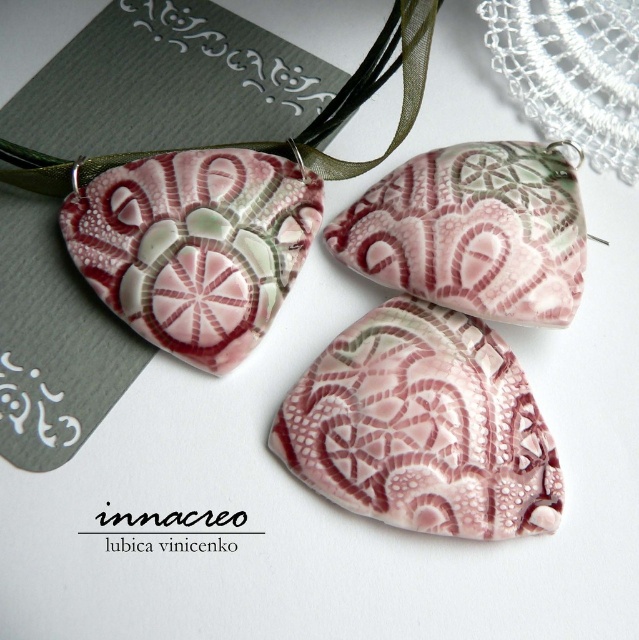
Is pink glossy pendant at center further to the viewer compared to white lace doily at upper right?

No, it is not.

Which is behind, point (502, 156) or point (557, 3)?

Positioned behind is point (502, 156).

The image size is (639, 640). I want to click on pink glossy pendant at center, so click(473, 230).

Find the location of `matte black card at upper center`. matte black card at upper center is located at coordinates (235, 52).

Is matte black card at upper center to the right of pink lace at upper left from the viewer's perspective?

Yes, matte black card at upper center is to the right of pink lace at upper left.

Is point (295, 60) closer to viewer compared to point (12, 426)?

No, (295, 60) is further to viewer.

Where is `matte black card at upper center`? matte black card at upper center is located at coordinates (235, 52).

Is pink porcelain pendant at center bigger than white lace doily at upper right?

Result: Yes, pink porcelain pendant at center is bigger than white lace doily at upper right.

The image size is (639, 640). What do you see at coordinates (194, 246) in the screenshot?
I see `pink porcelain pendant at center` at bounding box center [194, 246].

Does point (243, 275) lie in front of point (578, 128)?

Yes, it is.

The height and width of the screenshot is (640, 639). Find the location of `pink porcelain pendant at center`. pink porcelain pendant at center is located at coordinates (194, 246).